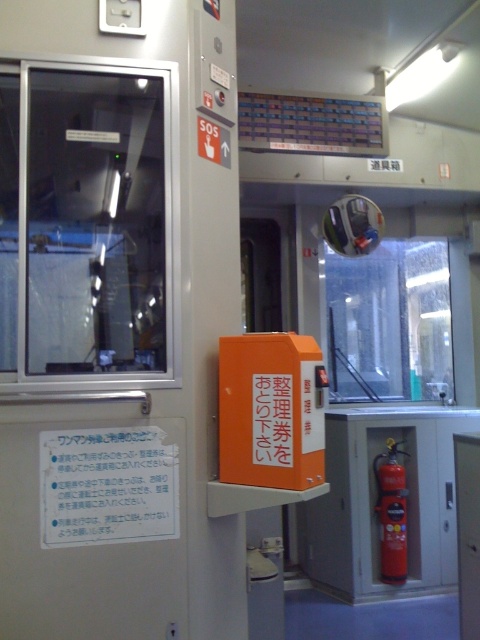
Between transparent glass door at upper left and red matte fire extinguisher at right, which one is positioned higher?

transparent glass door at upper left is above.

How far apart are transparent glass door at upper left and red matte fire extinguisher at right?

The distance of transparent glass door at upper left from red matte fire extinguisher at right is 8.77 feet.

Is point (180, 541) closer to viewer compared to point (393, 525)?

Yes, it is.

The width and height of the screenshot is (480, 640). I want to click on transparent glass door at upper left, so click(x=96, y=362).